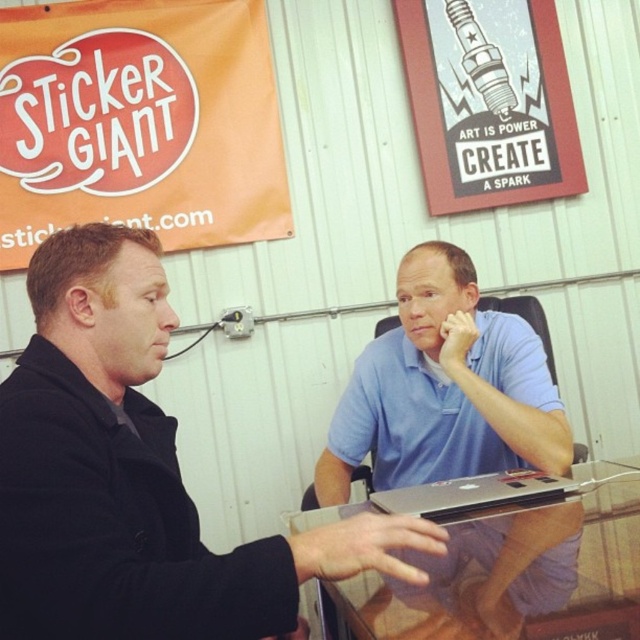
Question: Which point is closer to the camera taking this photo?

Choices:
 (A) (534, 472)
 (B) (534, 561)
 (C) (49, 516)

Answer: (C)

Question: Which object appears farthest from the camera in this image?

Choices:
 (A) blue cotton shirt at center
 (B) silver metallic laptop at center
 (C) black matte jacket at center

Answer: (A)

Question: Does black matte jacket at center appear on the right side of blue cotton shirt at center?

Choices:
 (A) yes
 (B) no

Answer: (B)

Question: Which of the following is the farthest from the observer?

Choices:
 (A) (413, 620)
 (B) (12, 374)

Answer: (B)

Question: Can you confirm if black matte jacket at center is thinner than transparent glass table at center?

Choices:
 (A) no
 (B) yes

Answer: (B)

Question: Can you confirm if black matte jacket at center is wider than blue cotton shirt at center?

Choices:
 (A) yes
 (B) no

Answer: (A)